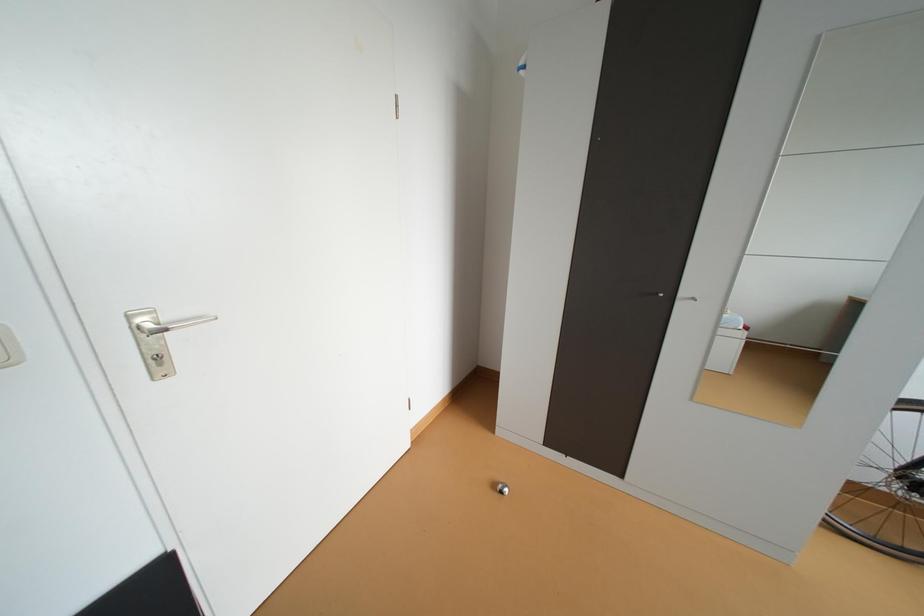
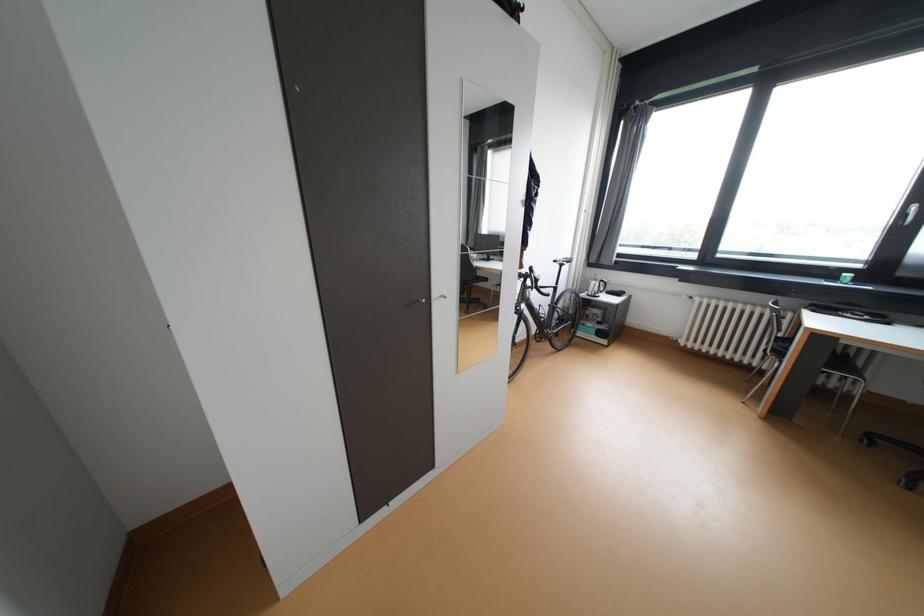
Question: The images are taken continuously from a first-person perspective. In which direction is your viewpoint rotating?

Choices:
 (A) Left
 (B) Right
 (C) Up
 (D) Down

Answer: (B)